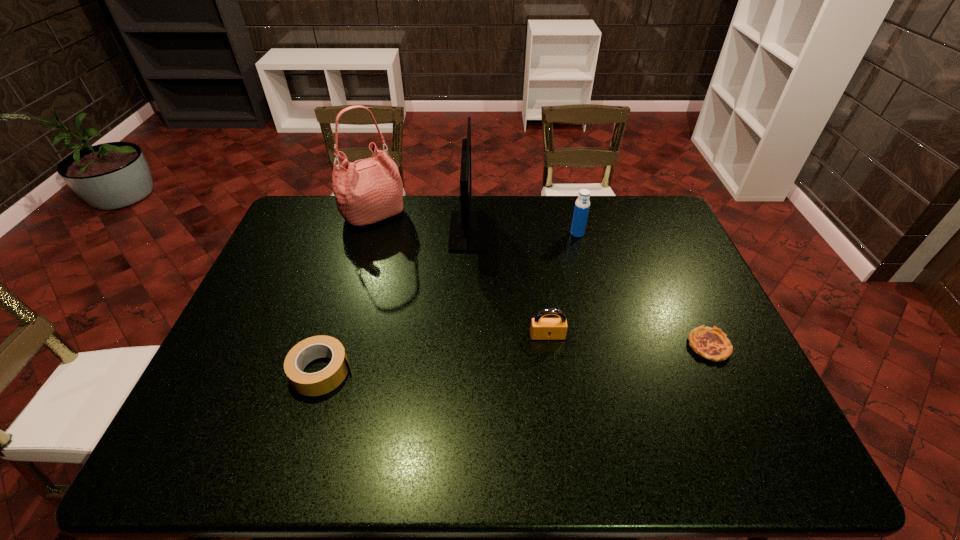
This screenshot has height=540, width=960. I want to click on handbag, so click(369, 190).

You are a GUI agent. You are given a task and a screenshot of the screen. Output one action in this format:
    pyautogui.click(x=<x>, y=<y>)
    Task: Click on the third object from left to right
    This screenshot has width=960, height=540.
    Given the screenshot: What is the action you would take?
    pyautogui.click(x=468, y=229)

The image size is (960, 540). I want to click on monitor, so click(468, 229).

I want to click on the third tallest object, so click(582, 204).

Identify the location of the second object from right to left. (582, 204).

Where is `the fourth tallest object`? the fourth tallest object is located at coordinates (541, 328).

Locate an element on the screen. padlock is located at coordinates (541, 328).

Locate an element on the screen. The image size is (960, 540). the second shortest object is located at coordinates pyautogui.click(x=322, y=382).

You are a GUI agent. You are given a task and a screenshot of the screen. Output one action in this format:
    pyautogui.click(x=<x>, y=<y>)
    Task: Click on the shortest object
    The width and height of the screenshot is (960, 540).
    Given the screenshot: What is the action you would take?
    pyautogui.click(x=712, y=344)

Where is `quiche`? The image size is (960, 540). quiche is located at coordinates (712, 344).